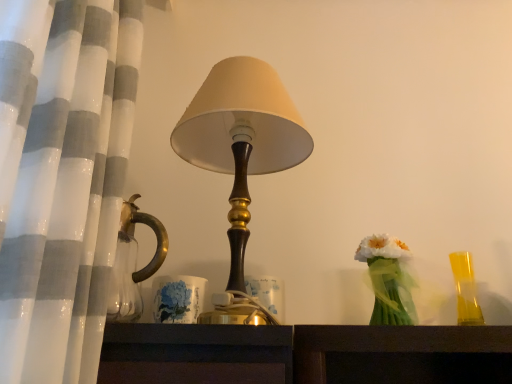
Question: Can matte brown lampshade at center be found inside translucent green vase at right?

Choices:
 (A) no
 (B) yes

Answer: (A)

Question: Is translucent green vase at right behind matte brown lampshade at center?

Choices:
 (A) yes
 (B) no

Answer: (A)

Question: Is translucent green vase at right next to matte brown lampshade at center?

Choices:
 (A) yes
 (B) no

Answer: (B)

Question: Considering the relative sizes of translucent green vase at right and matte brown lampshade at center in the image provided, is translucent green vase at right smaller than matte brown lampshade at center?

Choices:
 (A) yes
 (B) no

Answer: (A)

Question: Can you confirm if translucent green vase at right is thinner than matte brown lampshade at center?

Choices:
 (A) yes
 (B) no

Answer: (A)

Question: From the image's perspective, is translucent green vase at right located above matte brown lampshade at center?

Choices:
 (A) yes
 (B) no

Answer: (B)

Question: Does matte brown lampshade at center lie behind translucent yellow glass at right?

Choices:
 (A) no
 (B) yes

Answer: (A)

Question: Does matte brown lampshade at center have a larger size compared to translucent yellow glass at right?

Choices:
 (A) yes
 (B) no

Answer: (A)

Question: Is matte brown lampshade at center wider than translucent yellow glass at right?

Choices:
 (A) yes
 (B) no

Answer: (A)

Question: Is matte brown lampshade at center to the left of translucent yellow glass at right from the viewer's perspective?

Choices:
 (A) no
 (B) yes

Answer: (B)

Question: From a real-world perspective, is matte brown lampshade at center physically above translucent yellow glass at right?

Choices:
 (A) yes
 (B) no

Answer: (A)

Question: From the image's perspective, is matte brown lampshade at center located beneath translucent yellow glass at right?

Choices:
 (A) yes
 (B) no

Answer: (B)

Question: Is translucent green vase at right aimed at translucent yellow glass at right?

Choices:
 (A) no
 (B) yes

Answer: (A)